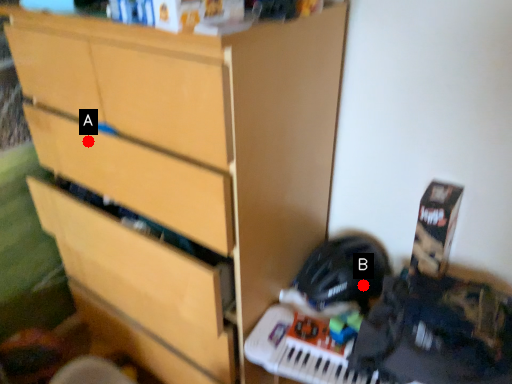
Question: Two points are circled on the image, labeled by A and B beside each circle. Which point is closer to the camera?

Choices:
 (A) A is closer
 (B) B is closer

Answer: (A)